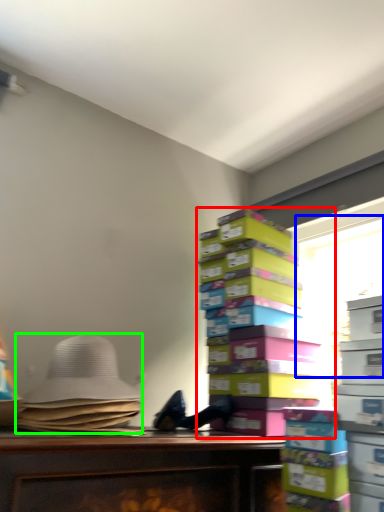
Question: Based on their relative distances, which object is farther from book (highlighted by a red box)? Choose from window screen (highlighted by a blue box) and wide (highlighted by a green box).

Choices:
 (A) window screen
 (B) wide

Answer: (B)